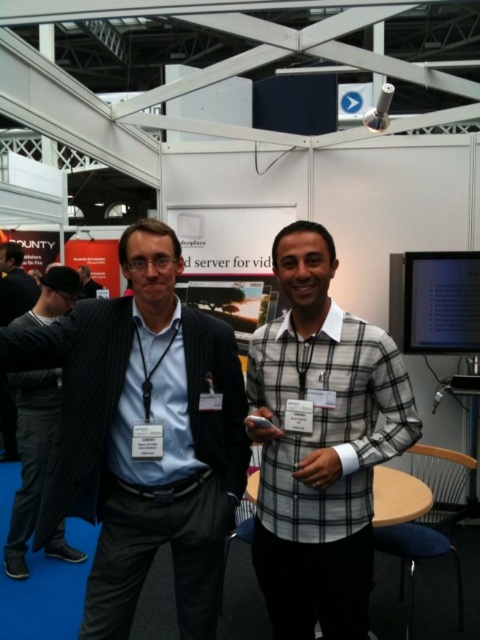
Question: Can you confirm if dark gray suit at center is positioned above matte black suit at center?

Choices:
 (A) no
 (B) yes

Answer: (A)

Question: Considering the real-world distances, which object is closest to the dark gray suit at center?

Choices:
 (A) plaid cotton shirt at center
 (B) black pinstripe suit at left

Answer: (B)

Question: Does black pinstripe suit at left appear on the right side of dark gray suit at center?

Choices:
 (A) no
 (B) yes

Answer: (B)

Question: Which object appears closest to the camera in this image?

Choices:
 (A) dark blue pinstripe suit at center
 (B) matte black suit at center
 (C) black pinstripe suit at left
 (D) plaid cotton shirt at center

Answer: (D)

Question: Is dark gray suit at center closer to the viewer compared to matte black suit at center?

Choices:
 (A) no
 (B) yes

Answer: (B)

Question: Which point is closer to the camera taking this photo?

Choices:
 (A) (343, 579)
 (B) (93, 292)
 (C) (41, 337)
 (D) (2, 273)

Answer: (A)